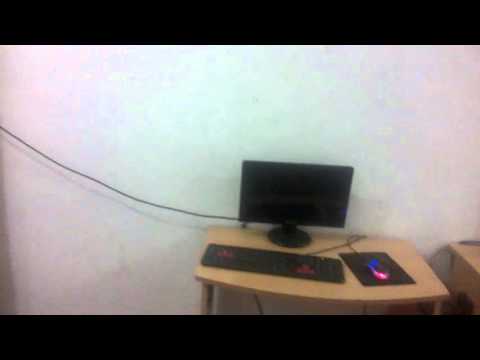
The width and height of the screenshot is (480, 360). What are the coordinates of `wall` in the screenshot? It's located at (226, 96).